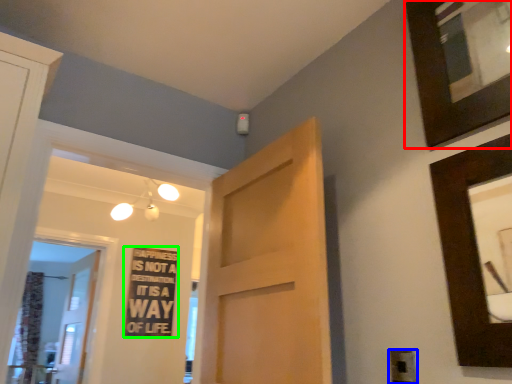
Question: Which object is positioned farthest from picture frame (highlighted by a red box)? Select from electric outlet (highlighted by a blue box) and warning sign (highlighted by a green box).

Choices:
 (A) electric outlet
 (B) warning sign

Answer: (B)